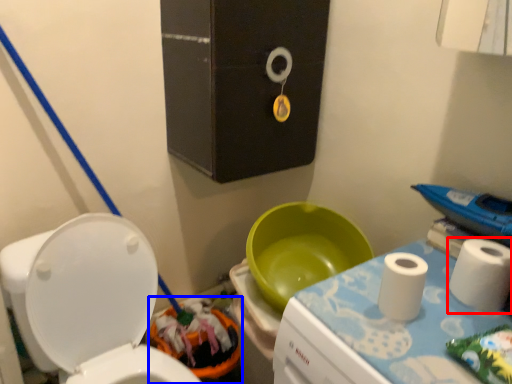
Question: Which object is closer to the camera taking this photo, toiletry (highlighted by a red box) or potty (highlighted by a blue box)?

Choices:
 (A) toiletry
 (B) potty

Answer: (A)